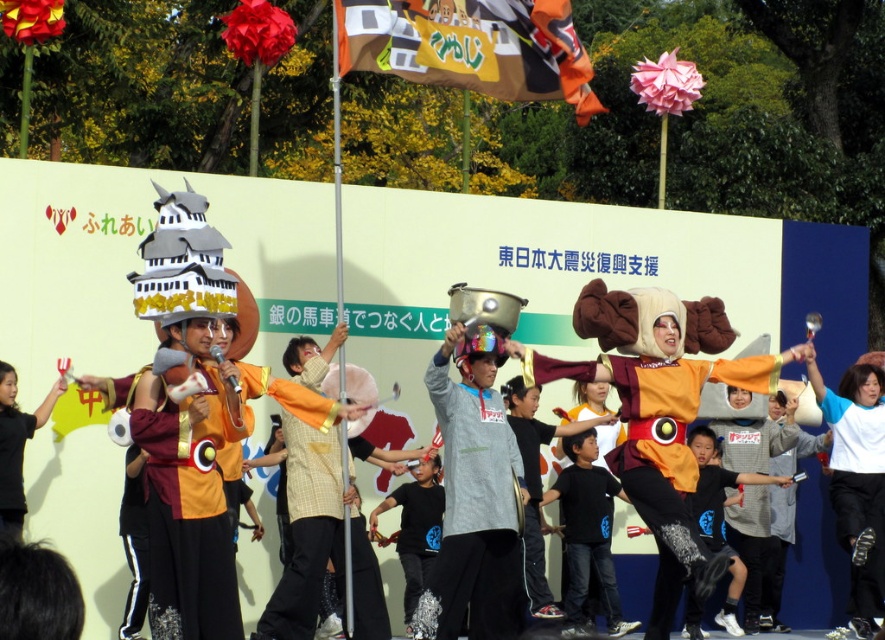
Does cardboard banner at upper center appear under black fabric shirt at left?

Incorrect, cardboard banner at upper center is not positioned below black fabric shirt at left.

In the scene shown: Who is positioned more to the right, cardboard banner at upper center or black fabric shirt at left?

From the viewer's perspective, cardboard banner at upper center appears more on the right side.

Who is more distant from viewer, [475,76] or [6,433]?

The point [475,76] is more distant.

Where is `cardboard banner at upper center`? cardboard banner at upper center is located at coordinates (470, 45).

Who is more distant from viewer, (x=717, y=509) or (x=12, y=468)?

Point (x=717, y=509)

Does black matte shirt at center come in front of black fabric shirt at left?

No, black matte shirt at center is behind black fabric shirt at left.

Is point (737, 560) positioned after point (21, 531)?

Yes, point (737, 560) is behind point (21, 531).

Where is `black matte shirt at center`? The height and width of the screenshot is (640, 885). black matte shirt at center is located at coordinates (721, 513).

Between point (573, 56) and point (716, 552), which one is positioned in front?

Point (573, 56) is more forward.

Measure the distance between cardboard banner at upper center and camera.

cardboard banner at upper center is 40.85 meters away from camera.

Is point (518, 65) closer to camera compared to point (703, 461)?

Yes, it is in front of point (703, 461).

Locate an element on the screen. The width and height of the screenshot is (885, 640). cardboard banner at upper center is located at coordinates (470, 45).